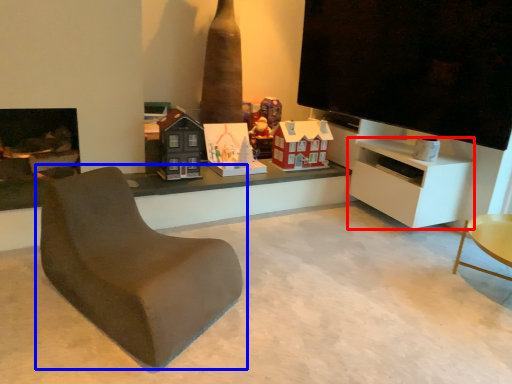
Question: Which point is closer to the camera, cabinetry (highlighted by a red box) or chair (highlighted by a blue box)?

Choices:
 (A) cabinetry
 (B) chair

Answer: (B)